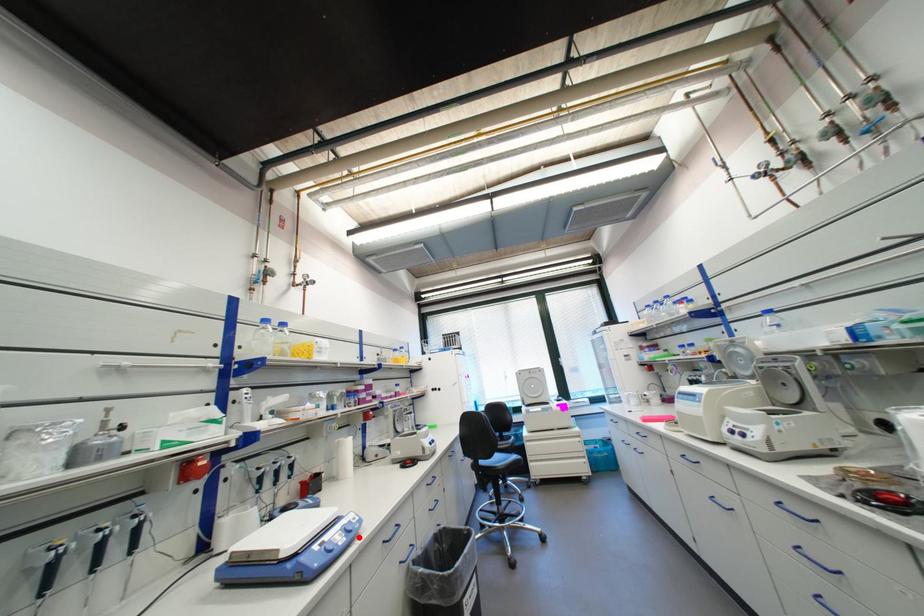
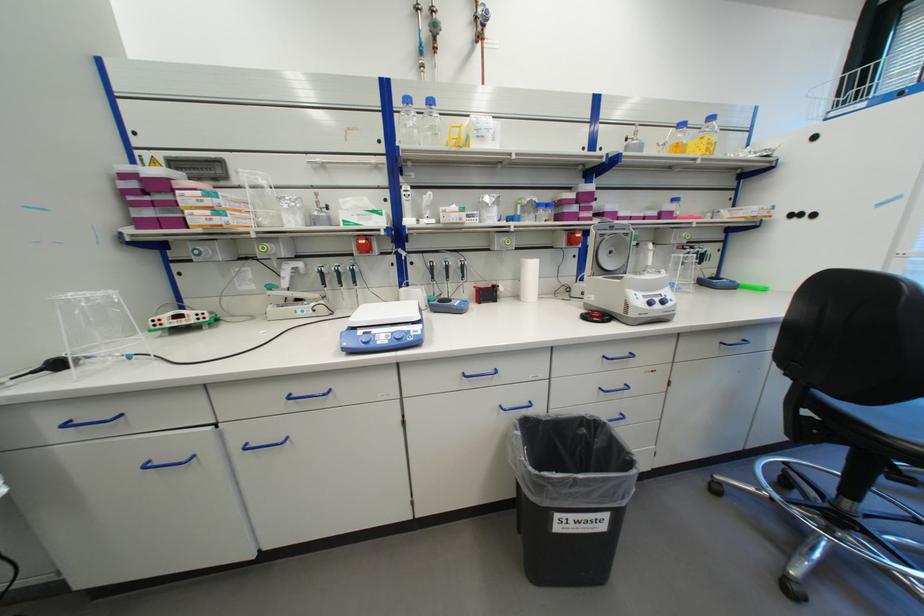
Find the pixel in the second image that matches the highlighted location in the first image.

(405, 344)